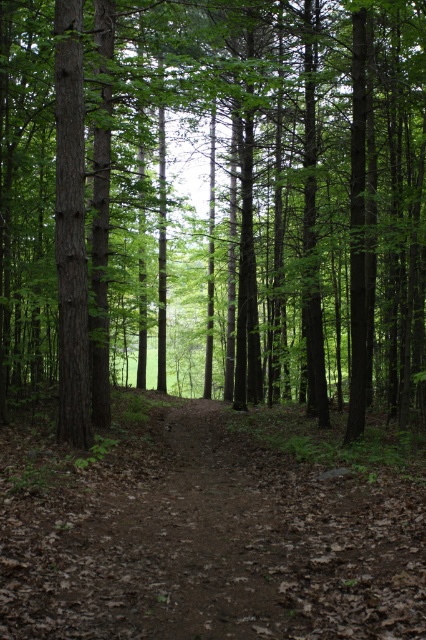
Describe the element at coordinates (218, 202) in the screenshot. The image size is (426, 640). I see `brown wood tree at center` at that location.

Is brown wood tree at center shorter than brown dirt trail at center?

No.

What are the coordinates of `brown wood tree at center` in the screenshot? It's located at (218, 202).